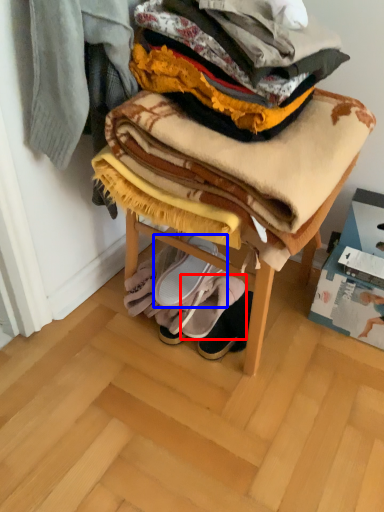
Question: Which of the following is the closest to the observer, footwear (highlighted by a red box) or footwear (highlighted by a blue box)?

Choices:
 (A) footwear
 (B) footwear

Answer: (A)